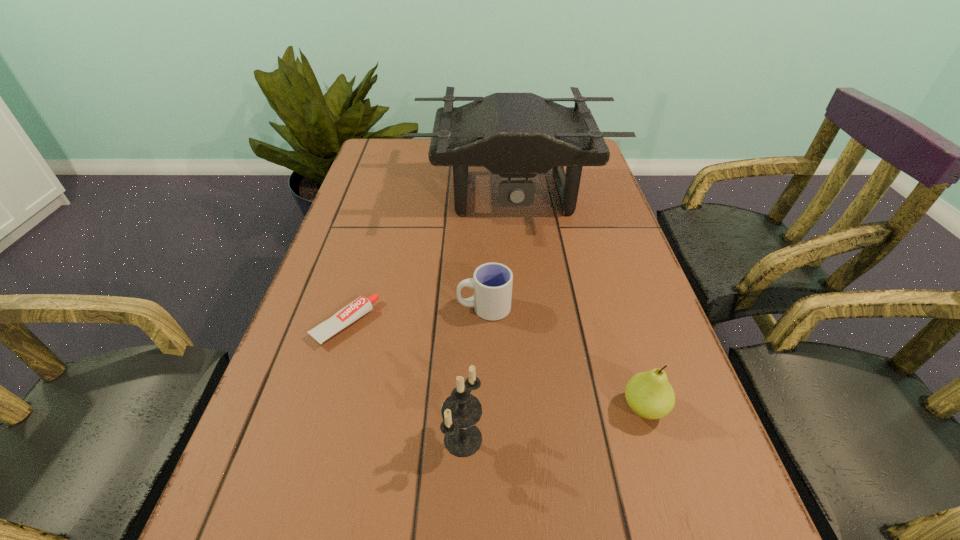
At what (x,y) coordinates should I click in order to perform the action: click on drone. Please return your answer as a coordinate pair (x, y). Looking at the image, I should click on (516, 135).

The image size is (960, 540). Find the location of `the tallest object`. the tallest object is located at coordinates (516, 135).

Where is `candle holder`? candle holder is located at coordinates pyautogui.click(x=461, y=411).

The width and height of the screenshot is (960, 540). I want to click on the third tallest object, so click(649, 394).

At what (x,y) coordinates should I click in order to perform the action: click on the fourth tallest object. Please return your answer as a coordinate pair (x, y). The height and width of the screenshot is (540, 960). Looking at the image, I should click on (492, 282).

This screenshot has width=960, height=540. What are the coordinates of `toothpaste` in the screenshot? It's located at (362, 305).

Where is `the shortest object`? the shortest object is located at coordinates (362, 305).

Find the location of a particular element. vacant space positioned 0.190m with a camera mounted on the underside of the tallest object is located at coordinates (522, 288).

You are a GUI agent. You are given a task and a screenshot of the screen. Output one action in this format:
    pyautogui.click(x=<x>, y=<y>)
    Task: Click on the blank space located on the right of the candle holder
    The image size is (960, 540).
    Given the screenshot: What is the action you would take?
    pyautogui.click(x=637, y=439)

The height and width of the screenshot is (540, 960). What are the coordinates of `free space located 0.050m on the left of the third tallest object` in the screenshot? It's located at (592, 408).